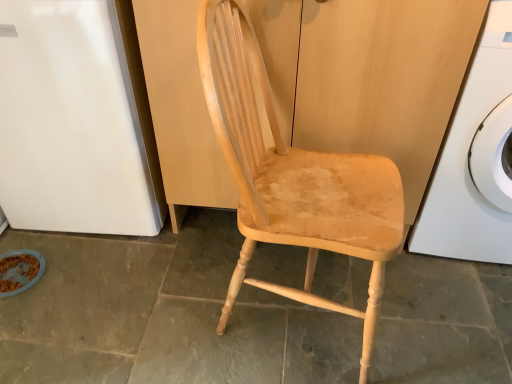
Question: From a real-world perspective, is natural wood dresser at center positioned under white glossy washing machine at right based on gravity?

Choices:
 (A) no
 (B) yes

Answer: (B)

Question: Considering the relative sizes of natural wood dresser at center and white glossy washing machine at right in the image provided, is natural wood dresser at center smaller than white glossy washing machine at right?

Choices:
 (A) no
 (B) yes

Answer: (A)

Question: Is natural wood dresser at center facing away from white glossy washing machine at right?

Choices:
 (A) yes
 (B) no

Answer: (B)

Question: Is natural wood dresser at center to the right of white glossy washing machine at right from the viewer's perspective?

Choices:
 (A) yes
 (B) no

Answer: (B)

Question: Considering the relative positions of natural wood dresser at center and white glossy washing machine at right in the image provided, is natural wood dresser at center in front of white glossy washing machine at right?

Choices:
 (A) no
 (B) yes

Answer: (A)

Question: From the image's perspective, would you say natural wood dresser at center is positioned over white glossy washing machine at right?

Choices:
 (A) no
 (B) yes

Answer: (B)

Question: Is white glossy refrigerator at left wider than natural wood dresser at center?

Choices:
 (A) no
 (B) yes

Answer: (B)

Question: Could you tell me if white glossy refrigerator at left is facing natural wood dresser at center?

Choices:
 (A) yes
 (B) no

Answer: (B)

Question: From the image's perspective, is white glossy refrigerator at left under natural wood dresser at center?

Choices:
 (A) no
 (B) yes

Answer: (A)

Question: From the image's perspective, would you say white glossy refrigerator at left is positioned over natural wood dresser at center?

Choices:
 (A) no
 (B) yes

Answer: (B)

Question: Does white glossy refrigerator at left have a lesser width compared to natural wood dresser at center?

Choices:
 (A) no
 (B) yes

Answer: (A)

Question: Considering the relative sizes of white glossy refrigerator at left and natural wood dresser at center in the image provided, is white glossy refrigerator at left smaller than natural wood dresser at center?

Choices:
 (A) no
 (B) yes

Answer: (B)

Question: Is natural wood dresser at center oriented towards brown crumbly food at lower left?

Choices:
 (A) no
 (B) yes

Answer: (A)